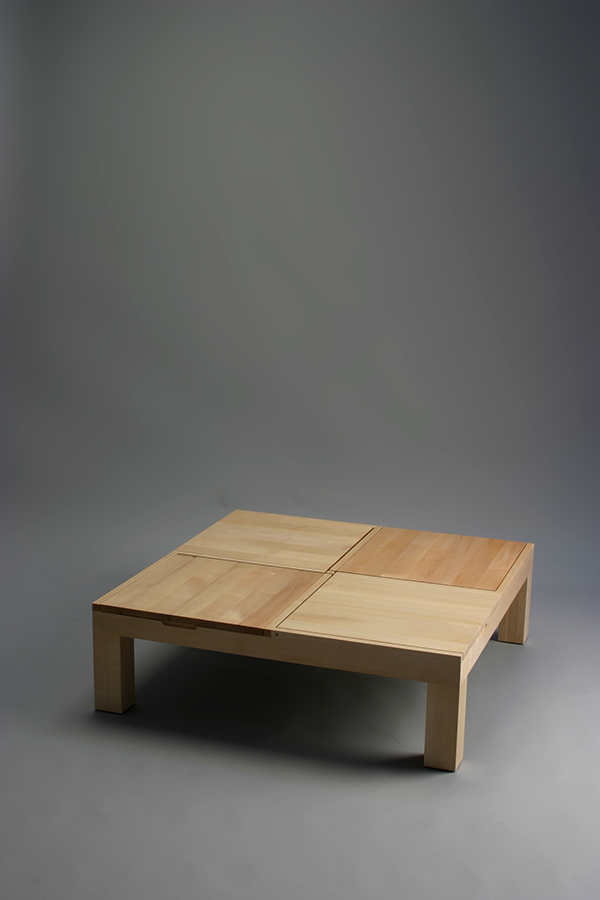
Where is `wood legs`? The width and height of the screenshot is (600, 900). wood legs is located at coordinates (101, 673), (441, 707), (512, 609).